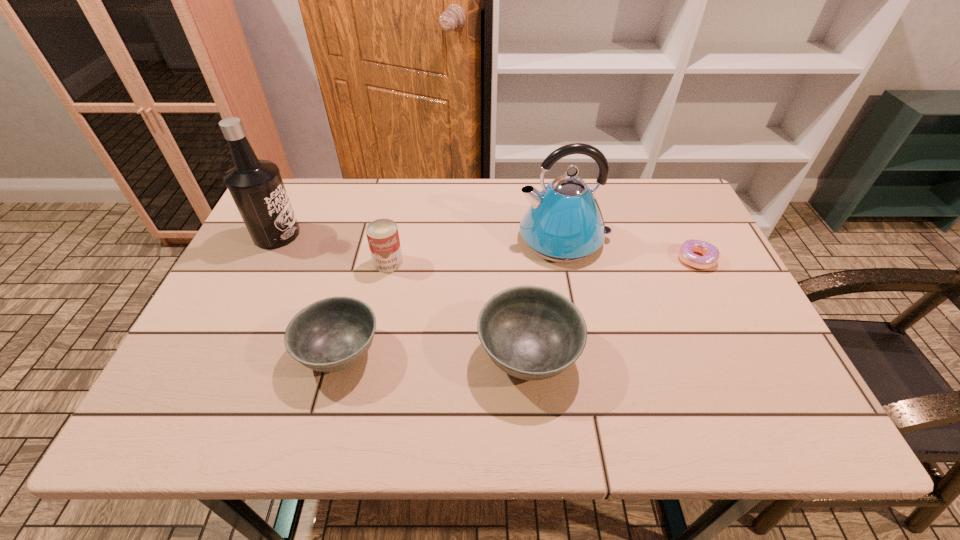
What are the coordinates of `object present at the far left corner` in the screenshot? It's located at click(x=256, y=186).

Identify the location of vacant space at the far edge of the desktop. The image size is (960, 540). (614, 200).

This screenshot has width=960, height=540. I want to click on free region at the near edge, so click(675, 373).

The height and width of the screenshot is (540, 960). I want to click on free space at the left edge, so click(x=228, y=330).

The width and height of the screenshot is (960, 540). What are the coordinates of `vacant area at the right edge of the desktop` in the screenshot? It's located at (730, 332).

You are a GUI agent. You are given a task and a screenshot of the screen. Output one action in this format:
    pyautogui.click(x=<x>, y=<y>)
    Task: Click on the free space at the far left corner of the desktop
    The width and height of the screenshot is (960, 540).
    Given the screenshot: What is the action you would take?
    pyautogui.click(x=320, y=186)

Image resolution: width=960 pixels, height=540 pixels. In the image, there is a desktop. Find the location of `vacant space at the far right corner`. vacant space at the far right corner is located at coordinates (651, 192).

Where is `vacant region at the near right corner`? vacant region at the near right corner is located at coordinates (750, 363).

Where is `free area in between the left bowl and the liquor`? Image resolution: width=960 pixels, height=540 pixels. free area in between the left bowl and the liquor is located at coordinates (308, 293).

At what (x,y) coordinates should I click in order to perform the action: click on vacant space in between the right bowl and the can. Please return your answer as a coordinate pair (x, y). Looking at the image, I should click on (458, 309).